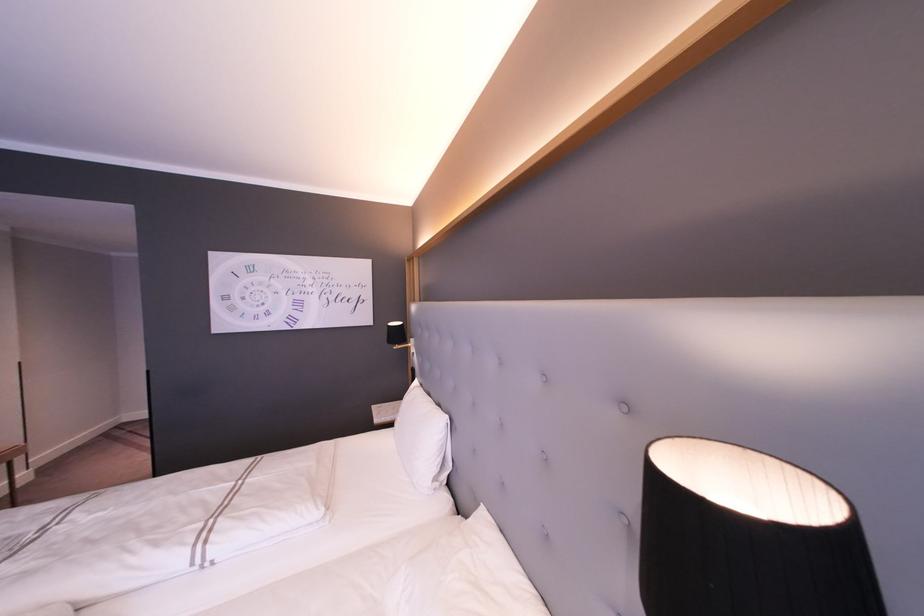
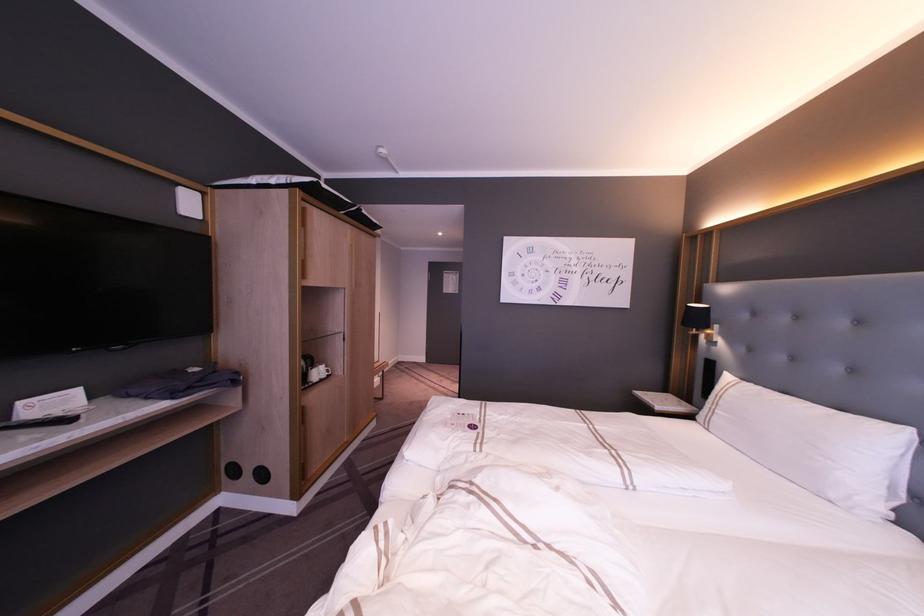
In the second image, find the point that corresponds to point (411, 339) in the first image.

(715, 326)